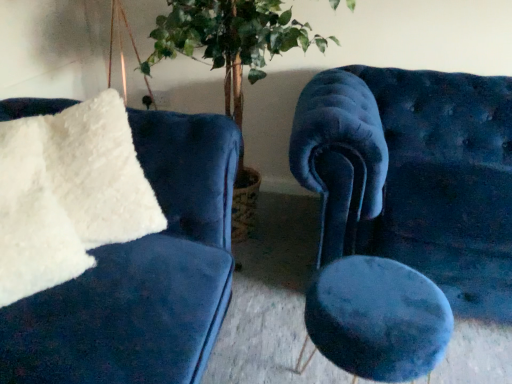
Question: Based on their positions, is velvet blue chair at right located to the left or right of white fluffy pillow at left?

Choices:
 (A) left
 (B) right

Answer: (B)

Question: Considering the positions of point (373, 135) and point (148, 198), is point (373, 135) closer or farther from the camera than point (148, 198)?

Choices:
 (A) farther
 (B) closer

Answer: (A)

Question: Which of these objects is positioned closest to the white fluffy pillow at left?

Choices:
 (A) velvet blue stool at center
 (B) velvet blue chair at right
 (C) green leafy plant at center

Answer: (A)

Question: Based on their relative distances, which object is farther from the white fluffy pillow at left?

Choices:
 (A) velvet blue chair at right
 (B) green leafy plant at center
 (C) velvet blue stool at center

Answer: (A)